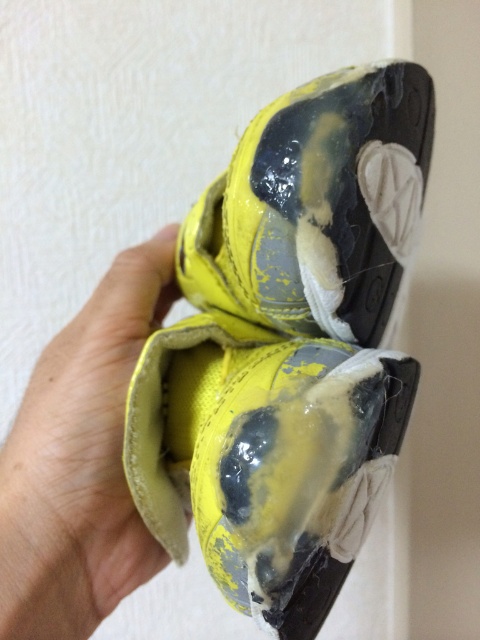
Question: Among these objects, which one is nearest to the camera?

Choices:
 (A) yellow matte shoe at center
 (B) yellow leather hand at center

Answer: (A)

Question: Can you confirm if yellow matte shoe at center is smaller than yellow leather hand at center?

Choices:
 (A) yes
 (B) no

Answer: (B)

Question: Which point appears farthest from the camera in this image?

Choices:
 (A) (369, 77)
 (B) (84, 307)

Answer: (B)

Question: Is yellow matte shoe at center further to camera compared to yellow leather hand at center?

Choices:
 (A) yes
 (B) no

Answer: (B)

Question: Is yellow matte shoe at center smaller than yellow leather hand at center?

Choices:
 (A) yes
 (B) no

Answer: (B)